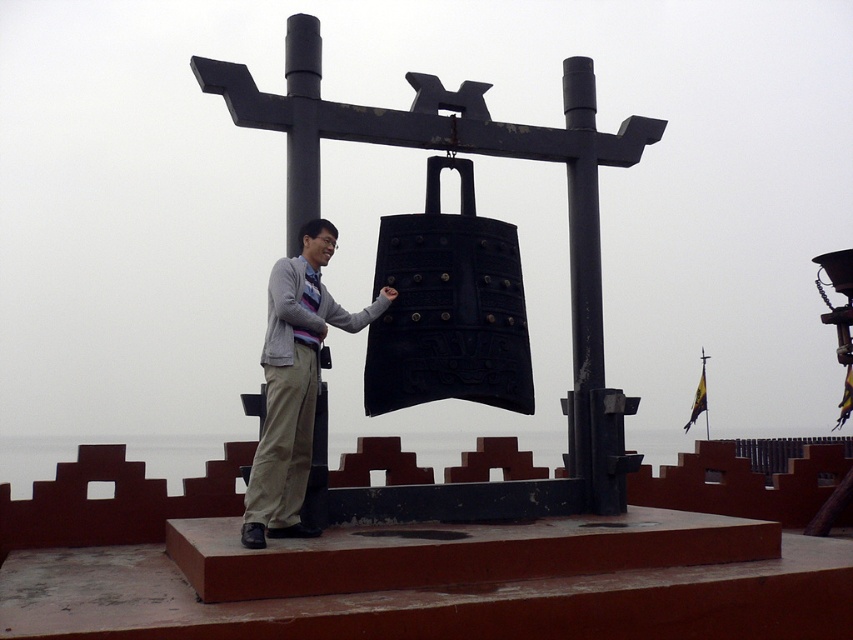
From the picture: Which is more to the left, black metal bell at center or light beige pants at center?

light beige pants at center

Locate an element on the screen. black metal bell at center is located at coordinates (479, 154).

Locate an element on the screen. The width and height of the screenshot is (853, 640). black metal bell at center is located at coordinates (479, 154).

You are a GUI agent. You are given a task and a screenshot of the screen. Output one action in this format:
    pyautogui.click(x=<x>, y=<y>)
    Task: Click on the black metal bell at center
    
    Given the screenshot: What is the action you would take?
    point(479,154)